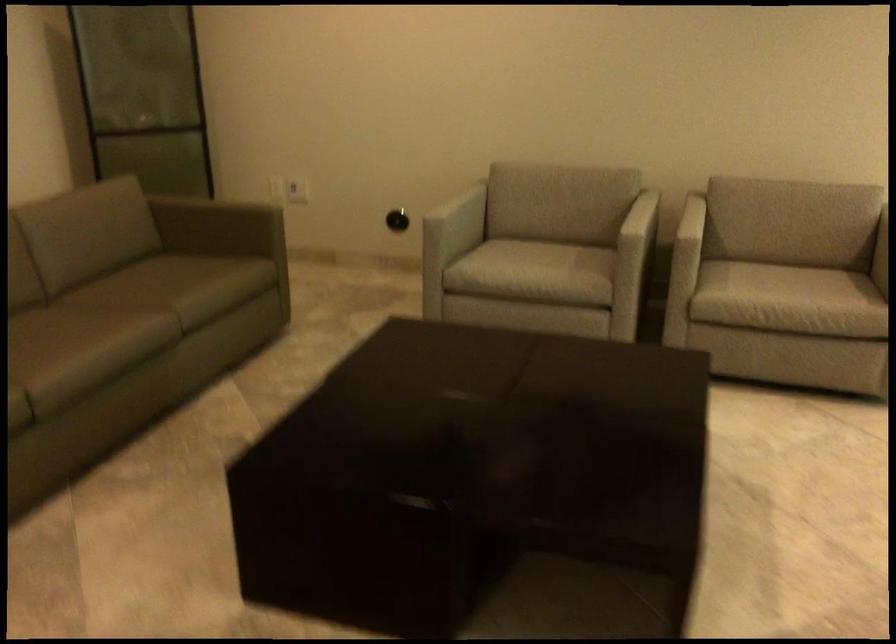
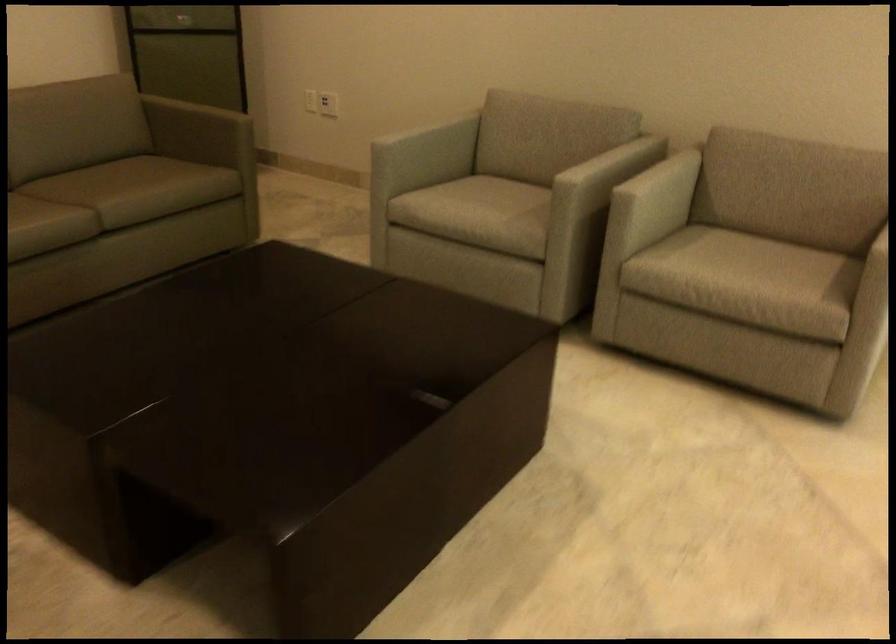
In the second image, find the point that corresponds to (x=214, y=281) in the first image.

(145, 187)